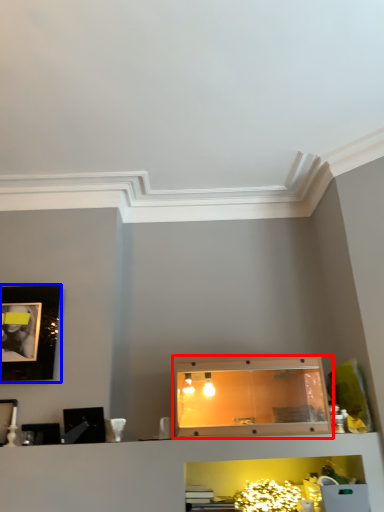
Question: Which point is further to the camera, cabinetry (highlighted by a red box) or picture frame (highlighted by a blue box)?

Choices:
 (A) cabinetry
 (B) picture frame

Answer: (B)